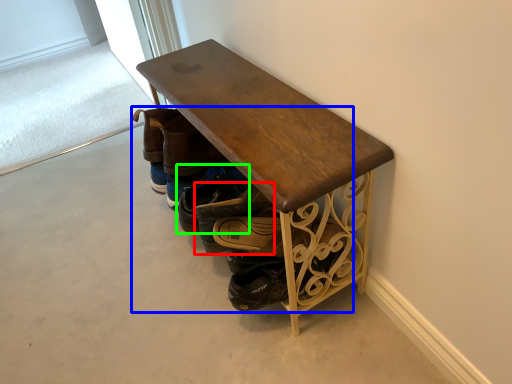
Question: Considering the real-world distances, which object is closest to footwear (highlighted by a red box)? footwear (highlighted by a blue box) or footwear (highlighted by a green box).

Choices:
 (A) footwear
 (B) footwear

Answer: (B)